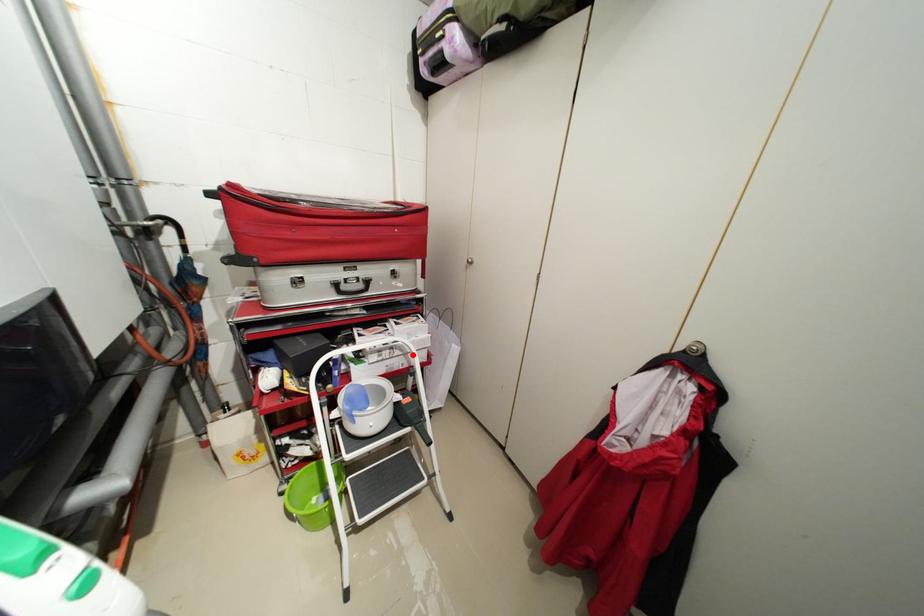
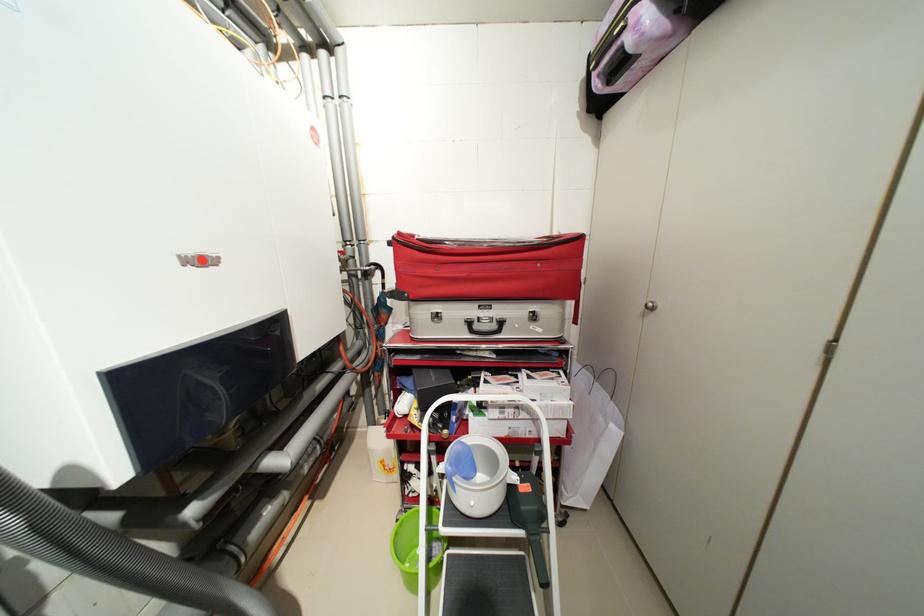
Question: A red point is marked in image1. In image2, is the corresponding 3D point closer to the camera or farther? Reply with the corresponding letter.

Choices:
 (A) The corresponding 3D point is closer.
 (B) The corresponding 3D point is farther.

Answer: (B)